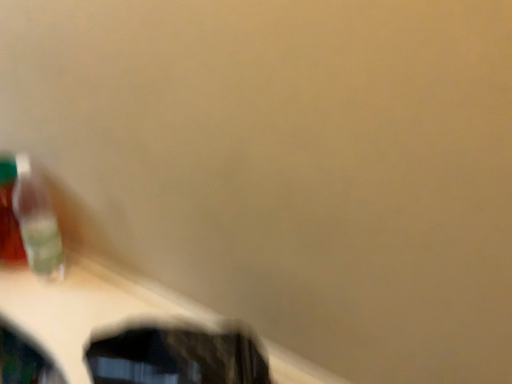
Question: Is wooden table at lower left facing towards translucent plastic toothbrush at left?

Choices:
 (A) yes
 (B) no

Answer: (B)

Question: Can you confirm if wooden table at lower left is thinner than translucent plastic toothbrush at left?

Choices:
 (A) yes
 (B) no

Answer: (B)

Question: From the image's perspective, would you say wooden table at lower left is shown under translucent plastic toothbrush at left?

Choices:
 (A) no
 (B) yes

Answer: (B)

Question: Does wooden table at lower left lie in front of translucent plastic toothbrush at left?

Choices:
 (A) no
 (B) yes

Answer: (B)

Question: Are wooden table at lower left and translucent plastic toothbrush at left making contact?

Choices:
 (A) yes
 (B) no

Answer: (B)

Question: Would you say wooden table at lower left is a long distance from translucent plastic toothbrush at left?

Choices:
 (A) no
 (B) yes

Answer: (A)

Question: Does translucent plastic toothbrush at left touch wooden table at lower left?

Choices:
 (A) no
 (B) yes

Answer: (A)

Question: Is translucent plastic toothbrush at left outside wooden table at lower left?

Choices:
 (A) yes
 (B) no

Answer: (A)

Question: Does translucent plastic toothbrush at left come in front of wooden table at lower left?

Choices:
 (A) no
 (B) yes

Answer: (A)

Question: Is translucent plastic toothbrush at left wider than wooden table at lower left?

Choices:
 (A) no
 (B) yes

Answer: (A)

Question: Does translucent plastic toothbrush at left have a smaller size compared to wooden table at lower left?

Choices:
 (A) yes
 (B) no

Answer: (A)

Question: Is translucent plastic toothbrush at left bigger than wooden table at lower left?

Choices:
 (A) yes
 (B) no

Answer: (B)

Question: Is translucent plastic toothbrush at left wider or thinner than wooden table at lower left?

Choices:
 (A) wide
 (B) thin

Answer: (B)